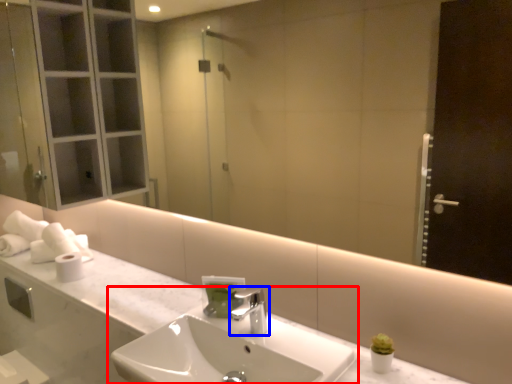
Question: Which object appears farthest to the camera in this image, sink (highlighted by a red box) or tap (highlighted by a blue box)?

Choices:
 (A) sink
 (B) tap

Answer: (B)